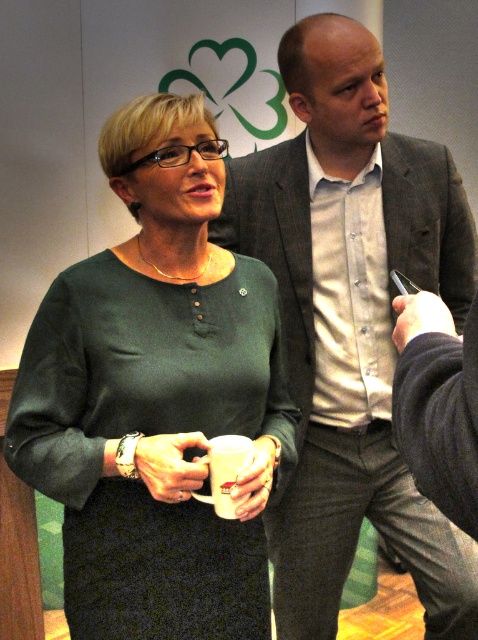
Question: Can you confirm if matte green dress at center is smaller than white matte mug at center?

Choices:
 (A) yes
 (B) no

Answer: (B)

Question: Which point appears closest to the camera in this image?

Choices:
 (A) (365, 250)
 (B) (217, 384)
 (C) (203, 460)

Answer: (C)

Question: Which of the following is the closest to the observer?

Choices:
 (A) (165, 449)
 (B) (241, 180)
 (C) (194, 497)

Answer: (A)

Question: Which object is closer to the camera taking this photo?

Choices:
 (A) white matte mug at center
 (B) matte green dress at center
 (C) matte gray suit at center

Answer: (B)

Question: Can you confirm if matte green dress at center is positioned to the left of white matte mug at center?

Choices:
 (A) no
 (B) yes

Answer: (B)

Question: Is matte green dress at center wider than matte gray suit at center?

Choices:
 (A) no
 (B) yes

Answer: (A)